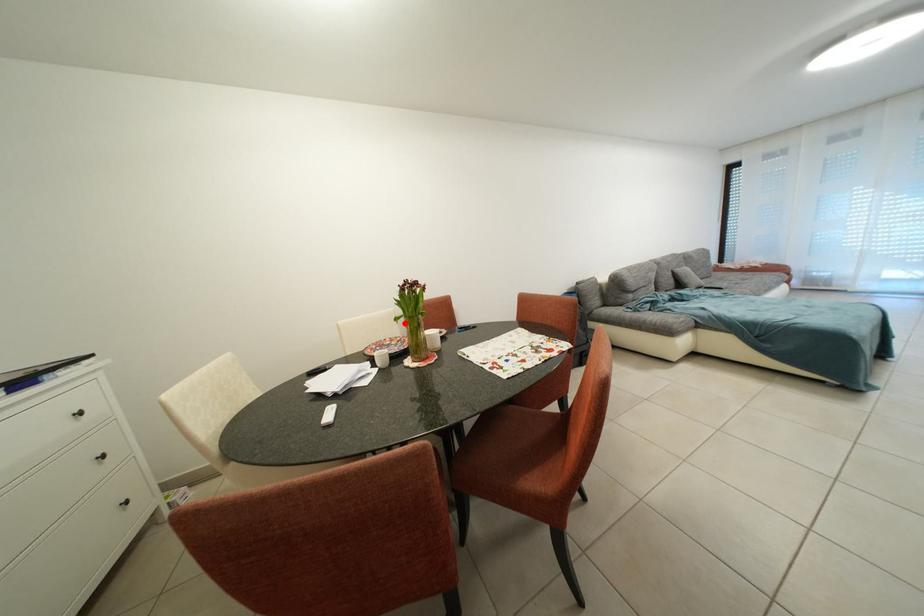
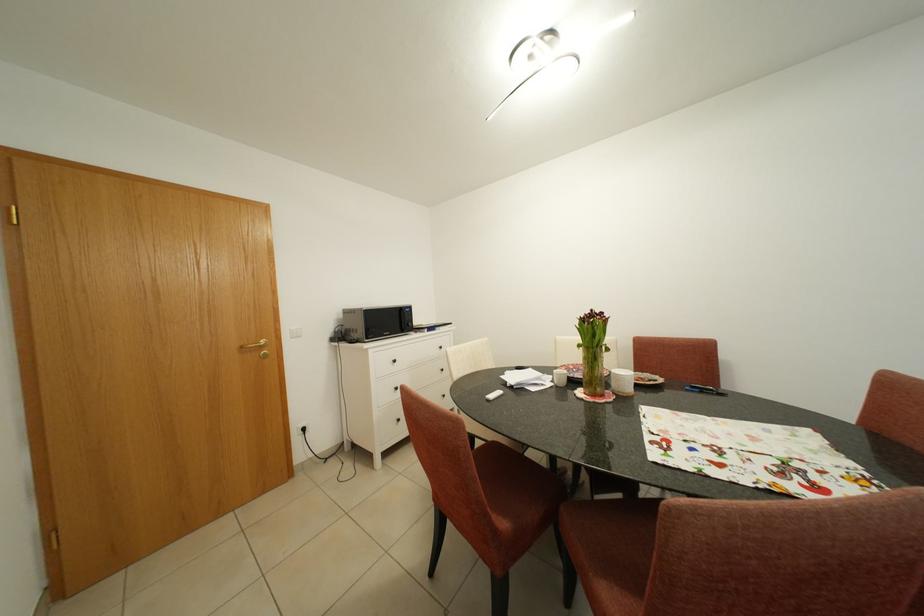
Question: I am providing you with two images of the same scene from different viewpoints. A red point is shown in image1. For the corresponding object point in image2, is it positioned nearer or farther from the camera?

Choices:
 (A) Nearer
 (B) Farther

Answer: (A)